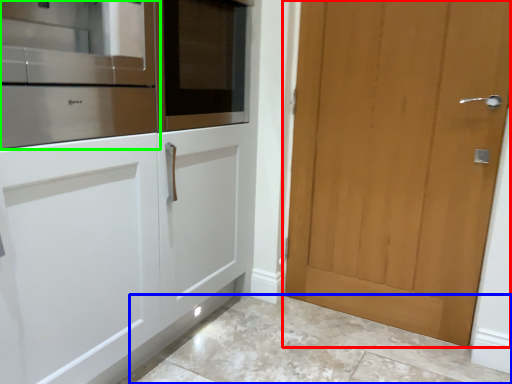
Question: Based on their relative distances, which object is nearer to door (highlighted by a red box)? Choose from granite (highlighted by a blue box) and cabinetry (highlighted by a green box).

Choices:
 (A) granite
 (B) cabinetry

Answer: (A)